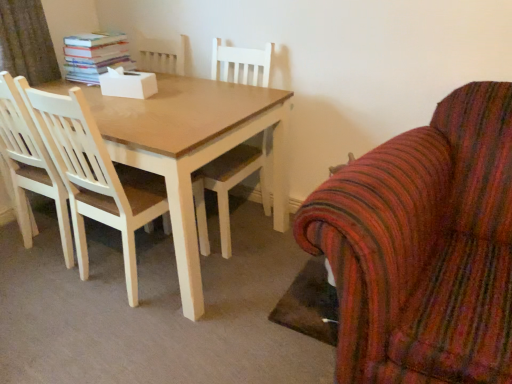
The width and height of the screenshot is (512, 384). Identify the location of vacant area that is in front of light wood chair at left, positioned as the 1th chair in left-to-right order. (112, 334).